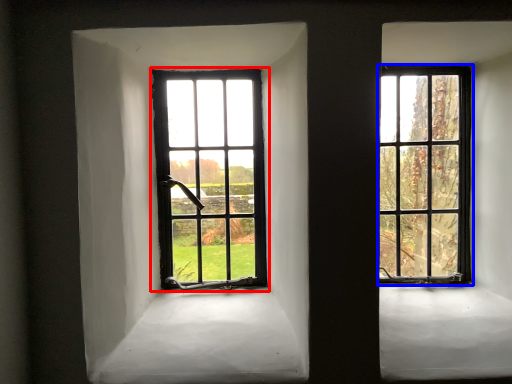
Question: Which of the following is the closest to the observer, window (highlighted by a red box) or window (highlighted by a blue box)?

Choices:
 (A) window
 (B) window

Answer: (B)